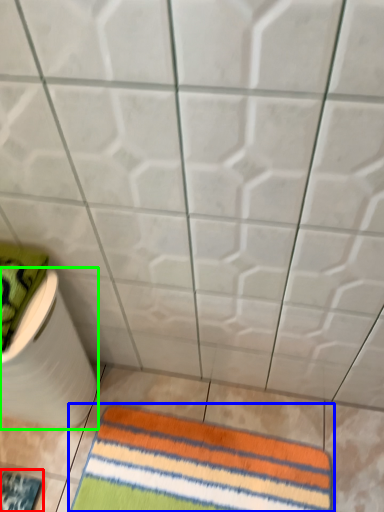
Question: Based on their relative distances, which object is nearer to mat (highlighted by a red box)? Choose from towel (highlighted by a blue box) and toilet paper (highlighted by a green box).

Choices:
 (A) towel
 (B) toilet paper

Answer: (B)